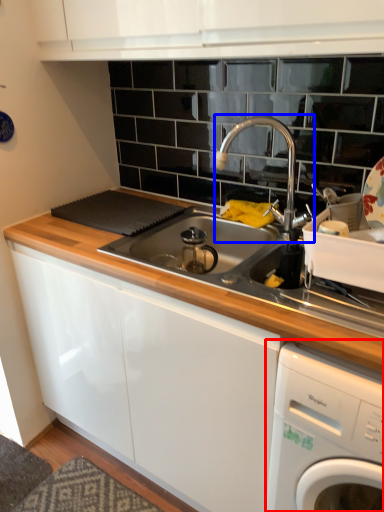
Question: Which object is further to the camera taking this photo, home appliance (highlighted by a red box) or tap (highlighted by a blue box)?

Choices:
 (A) home appliance
 (B) tap

Answer: (B)